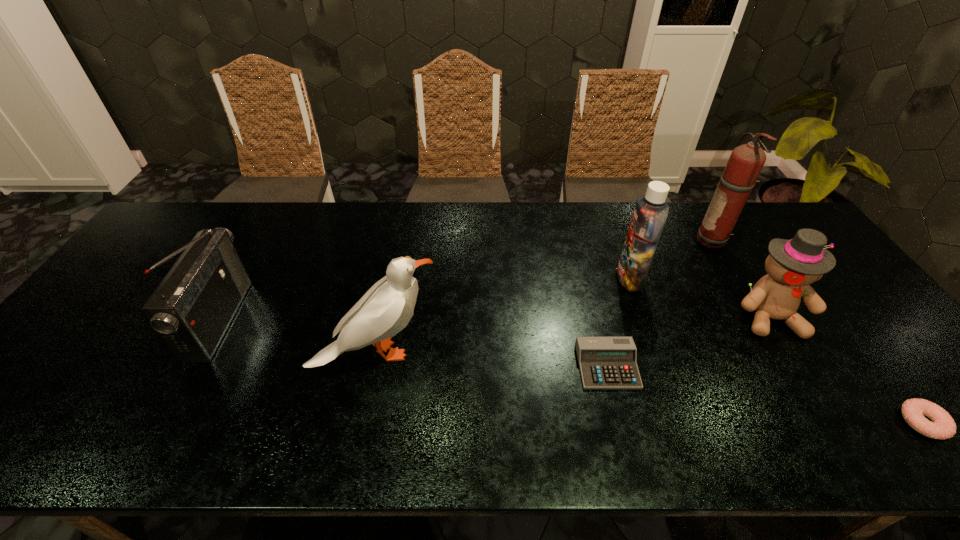
At what (x,y) coordinates should I click in order to perform the action: click on vacant space at the left edge of the desktop. Please return your answer as a coordinate pair (x, y). The height and width of the screenshot is (540, 960). Looking at the image, I should click on click(x=132, y=293).

The image size is (960, 540). I want to click on free space at the far left corner of the desktop, so click(x=184, y=241).

In the image, there is a desktop. Identify the location of vacant space at the near left corner. (22, 433).

Where is `free point between the rag_doll and the leftmost object`? The width and height of the screenshot is (960, 540). free point between the rag_doll and the leftmost object is located at coordinates (494, 318).

This screenshot has height=540, width=960. Find the location of `free space between the radio receiver and the fifth object from right to left`. free space between the radio receiver and the fifth object from right to left is located at coordinates (414, 343).

Identify the location of free space between the sixth object from right to left and the radio receiver. This screenshot has width=960, height=540. (299, 336).

I want to click on empty location between the rag_doll and the gull, so click(573, 334).

In order to click on free space between the fire extinguisher and the calculator in this screenshot , I will do `click(660, 304)`.

Find the location of a particular element. free space between the tallest object and the radio receiver is located at coordinates (467, 281).

What are the coordinates of `object identified as the third closest to the doughnut` in the screenshot? It's located at (605, 362).